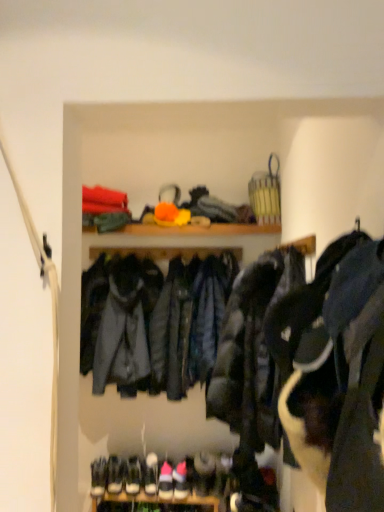
Question: Is white leather sneaker at lower center, marked as the 2th shoe in a right-to-left arrangement, inside white suede sneakers at lower center, the 3th footwear in the left-to-right sequence?

Choices:
 (A) no
 (B) yes

Answer: (A)

Question: Is white suede sneakers at lower center, placed as the first footwear when sorted from right to left, not inside white leather sneaker at lower center, placed as the first shoe when sorted from left to right?

Choices:
 (A) yes
 (B) no

Answer: (A)

Question: Is the position of white suede sneakers at lower center, the 3th footwear in the left-to-right sequence, more distant than that of white leather sneaker at lower center, placed as the first shoe when sorted from left to right?

Choices:
 (A) no
 (B) yes

Answer: (A)

Question: Does white suede sneakers at lower center, placed as the first footwear when sorted from right to left, lie in front of white leather sneaker at lower center, placed as the first shoe when sorted from left to right?

Choices:
 (A) yes
 (B) no

Answer: (A)

Question: From the image's perspective, does white suede sneakers at lower center, placed as the first footwear when sorted from right to left, appear lower than white leather sneaker at lower center, marked as the 2th shoe in a right-to-left arrangement?

Choices:
 (A) yes
 (B) no

Answer: (A)

Question: Would you say white suede sneaker at lower center, which is the second footwear in right-to-left order, is to the left or to the right of yellow fabric basket at upper center in the picture?

Choices:
 (A) right
 (B) left

Answer: (B)

Question: Considering the positions of white suede sneaker at lower center, which is the second footwear in right-to-left order, and yellow fabric basket at upper center in the image, is white suede sneaker at lower center, which is the second footwear in right-to-left order, bigger or smaller than yellow fabric basket at upper center?

Choices:
 (A) small
 (B) big

Answer: (A)

Question: Does point (170, 476) appear closer or farther from the camera than point (236, 226)?

Choices:
 (A) closer
 (B) farther

Answer: (B)

Question: From a real-world perspective, is white suede sneaker at lower center, marked as the second footwear in a left-to-right arrangement, positioned above or below yellow fabric basket at upper center?

Choices:
 (A) above
 (B) below

Answer: (B)

Question: Choose the correct answer: Is white suede sneakers at lower center, which ranks as the 3th footwear in right-to-left order, inside dark blue leather jacket at center, acting as the first jacket starting from the back, or outside it?

Choices:
 (A) outside
 (B) inside

Answer: (A)

Question: Is white suede sneakers at lower center, the first footwear when ordered from left to right, wider or thinner than dark blue leather jacket at center, acting as the second jacket starting from the front?

Choices:
 (A) thin
 (B) wide

Answer: (A)

Question: Is white suede sneakers at lower center, the first footwear when ordered from left to right, to the left or to the right of dark blue leather jacket at center, acting as the first jacket starting from the back, in the image?

Choices:
 (A) right
 (B) left

Answer: (B)

Question: Is white suede sneakers at lower center, the first footwear when ordered from left to right, bigger or smaller than dark blue leather jacket at center, acting as the first jacket starting from the back?

Choices:
 (A) big
 (B) small

Answer: (B)

Question: In the image, is white leather sneaker at lower center, placed as the first shoe when sorted from left to right, positioned in front of or behind white suede sneaker at lower center, which is the second footwear in right-to-left order?

Choices:
 (A) behind
 (B) front

Answer: (A)

Question: Based on their sizes in the image, would you say white leather sneaker at lower center, placed as the first shoe when sorted from left to right, is bigger or smaller than white suede sneaker at lower center, marked as the second footwear in a left-to-right arrangement?

Choices:
 (A) big
 (B) small

Answer: (A)